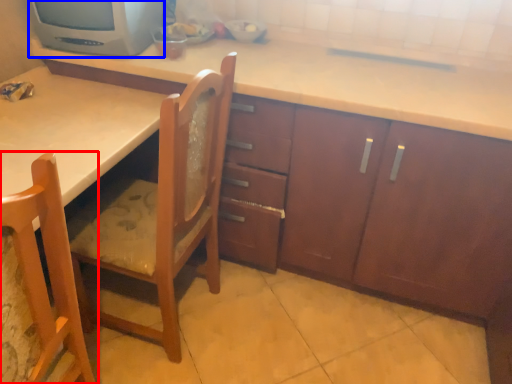
Question: Which point is further to the camera, chair (highlighted by a red box) or home appliance (highlighted by a blue box)?

Choices:
 (A) chair
 (B) home appliance

Answer: (B)